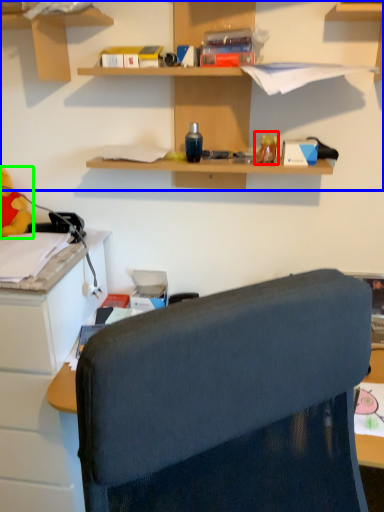
Question: Which is farther away from toy (highlighted by a red box)? shelf (highlighted by a blue box) or toy (highlighted by a green box)?

Choices:
 (A) shelf
 (B) toy

Answer: (B)